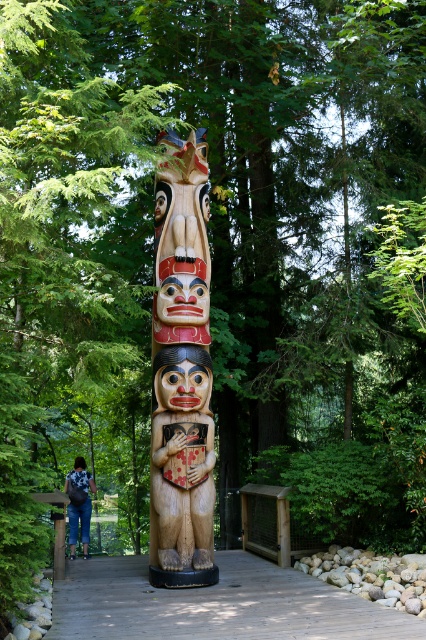
The width and height of the screenshot is (426, 640). I want to click on wooden walkway at center, so click(215, 604).

Is point (195, 621) behind point (75, 468)?

No, (195, 621) is closer to viewer.

Image resolution: width=426 pixels, height=640 pixels. Identify the location of wooden walkway at center. (215, 604).

Measure the distance from carved wood totem pole at center to wooden walkway at center.

They are 1.46 meters apart.

Which of these two, carved wood totem pole at center or wooden walkway at center, stands taller?

With more height is carved wood totem pole at center.

Is point (192, 140) positioned before point (91, 627)?

No, it is behind (91, 627).

Image resolution: width=426 pixels, height=640 pixels. In order to click on carved wood totem pole at center in this screenshot , I will do `click(181, 371)`.

Is carved wood totem pole at center taller than wooden totem pole at center?

Correct, carved wood totem pole at center is much taller as wooden totem pole at center.

Is point (187, 492) positioned before point (155, 531)?

Yes, point (187, 492) is in front of point (155, 531).

Image resolution: width=426 pixels, height=640 pixels. I want to click on carved wood totem pole at center, so [181, 371].